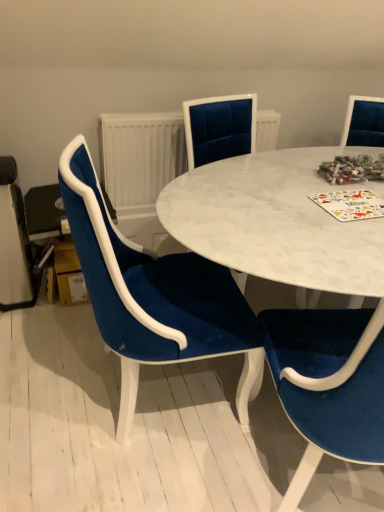
At what (x,y) coordinates should I click in order to perform the action: click on free space in front of multicolored paper at center. Please return your answer as a coordinate pair (x, y). This screenshot has height=512, width=384. Looking at the image, I should click on (347, 230).